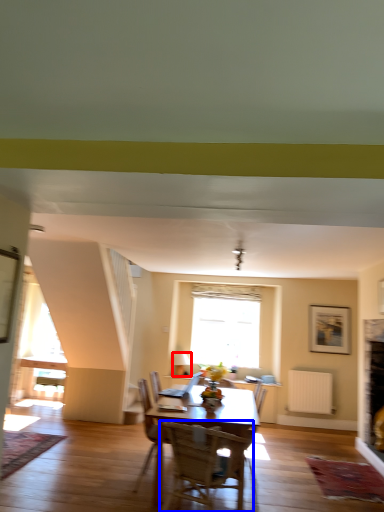
Question: Which point is further to the camera, lamp (highlighted by a red box) or chair (highlighted by a blue box)?

Choices:
 (A) lamp
 (B) chair

Answer: (A)